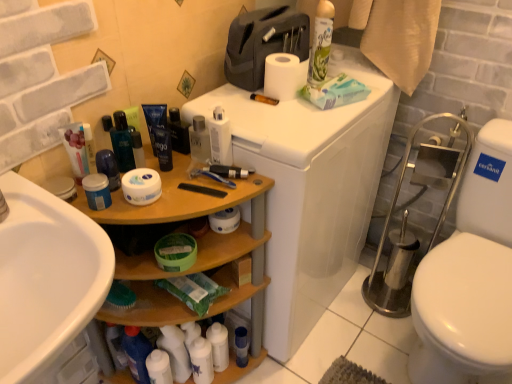
You are a GUI agent. You are given a task and a screenshot of the screen. Output one action in this format:
    pyautogui.click(x=<x>, y=<y>)
    Task: Click on the free space in front of white glossy toilet paper at upper right
    This screenshot has height=384, width=512.
    Given the screenshot: What is the action you would take?
    pyautogui.click(x=318, y=126)